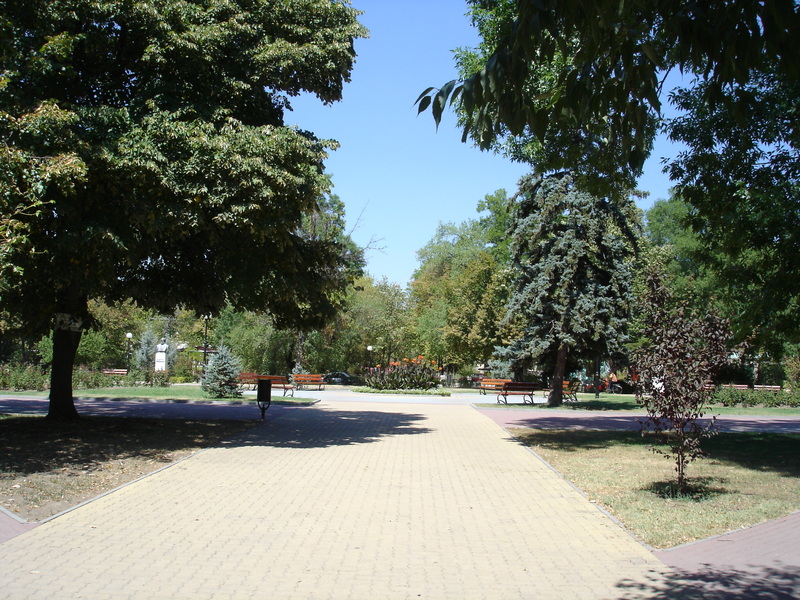
Identify the location of bust of statue. (162, 346).